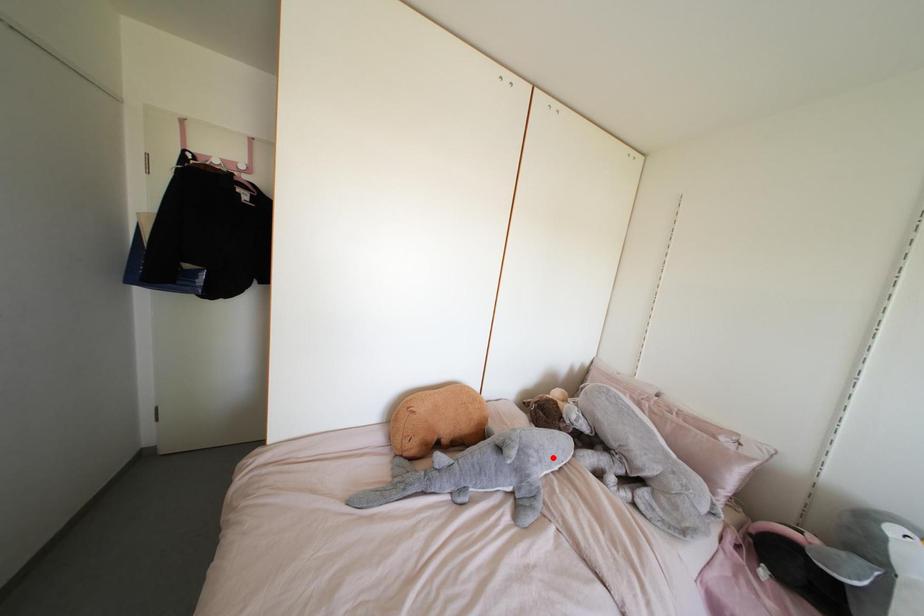
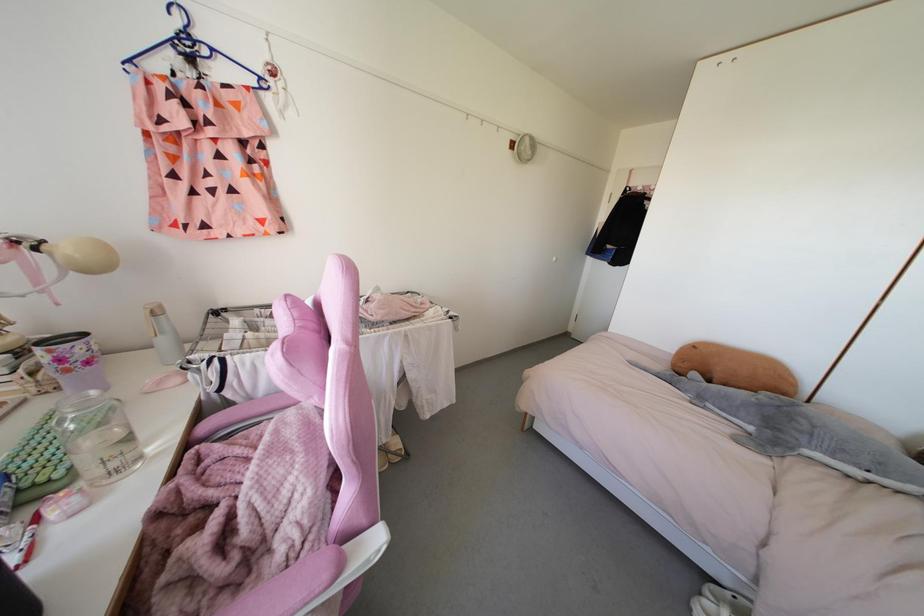
In the second image, find the point that corresponds to the highlighted location in the first image.

(843, 450)